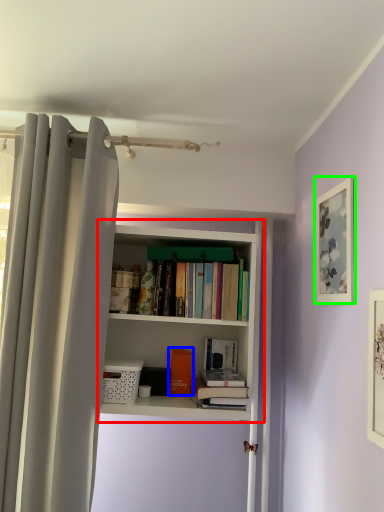
Question: Which object is the farthest from bookcase (highlighted by a red box)? Choose among these: book (highlighted by a blue box) or picture frame (highlighted by a green box).

Choices:
 (A) book
 (B) picture frame

Answer: (B)